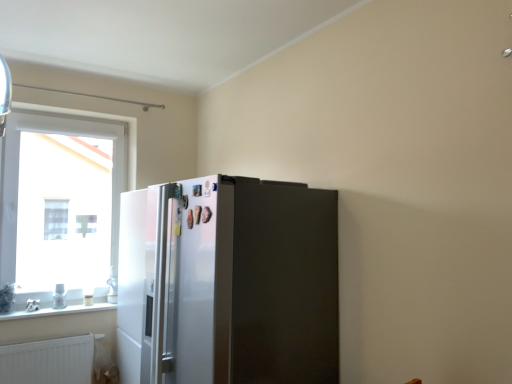
Question: Is white matte radiator at lower left outside of satin silver refrigerator at center?

Choices:
 (A) yes
 (B) no

Answer: (A)

Question: Is white matte radiator at lower left positioned before satin silver refrigerator at center?

Choices:
 (A) yes
 (B) no

Answer: (B)

Question: Is the position of white matte radiator at lower left more distant than that of satin silver refrigerator at center?

Choices:
 (A) no
 (B) yes

Answer: (B)

Question: Can you confirm if white matte radiator at lower left is thinner than satin silver refrigerator at center?

Choices:
 (A) no
 (B) yes

Answer: (B)

Question: Is white matte radiator at lower left with satin silver refrigerator at center?

Choices:
 (A) yes
 (B) no

Answer: (B)

Question: From the image's perspective, is white matte radiator at lower left on satin silver refrigerator at center?

Choices:
 (A) no
 (B) yes

Answer: (A)

Question: Does satin silver refrigerator at center turn towards white glossy window sill at lower left?

Choices:
 (A) yes
 (B) no

Answer: (B)

Question: Is satin silver refrigerator at center turned away from white glossy window sill at lower left?

Choices:
 (A) no
 (B) yes

Answer: (A)

Question: Is satin silver refrigerator at center in front of white glossy window sill at lower left?

Choices:
 (A) no
 (B) yes

Answer: (B)

Question: Can you confirm if satin silver refrigerator at center is wider than white glossy window sill at lower left?

Choices:
 (A) no
 (B) yes

Answer: (B)

Question: Does satin silver refrigerator at center lie behind white glossy window sill at lower left?

Choices:
 (A) yes
 (B) no

Answer: (B)

Question: From a real-world perspective, is satin silver refrigerator at center positioned over white glossy window sill at lower left based on gravity?

Choices:
 (A) no
 (B) yes

Answer: (B)

Question: Is white glossy window sill at lower left to the left of satin silver refrigerator at center from the viewer's perspective?

Choices:
 (A) yes
 (B) no

Answer: (A)